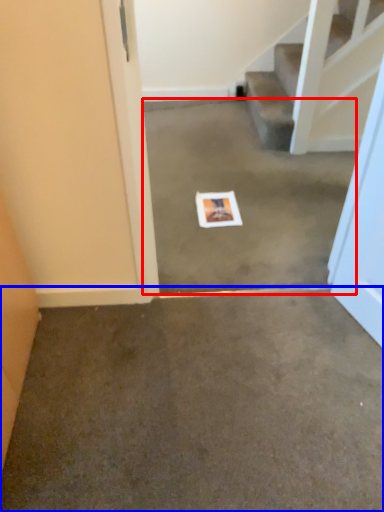
Question: Among these objects, which one is nearest to the camera, concrete (highlighted by a red box) or concrete (highlighted by a blue box)?

Choices:
 (A) concrete
 (B) concrete

Answer: (B)